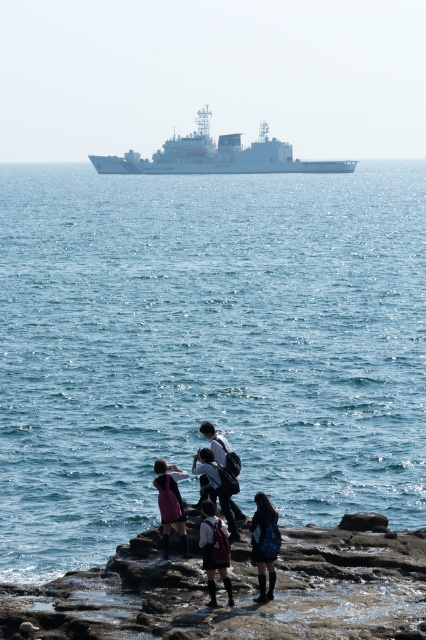
You are a photographer standing at the edge of the rocky shoreline. You want to capture a photo that includes both the point at coordinate point (x=192, y=611) and point at coordinate point (x=233, y=512). Which point will appear larger in your photo?

Point (x=192, y=611) is closer to the camera than point (x=233, y=512), so it will appear larger in the photo.

You are standing on the rugged stone coast at lower center represented by point (x=236, y=592). You want to move towards the ocean waves in the middle ground. Is the path clear of obstacles between your current position and the waves?

The rugged stone coast at lower center is represented by point (x=236, y=592). The path to the ocean waves in the middle ground is clear of obstacles as there are no objects mentioned between them in the scene description.

You are a photographer trying to capture the group of tourists on the rocky shoreline. You notice a point at coordinates point (213, 548). Based on the scene description, what object is located at that point?

The point (213, 548) is located on the dark blue denim skirt at center, which is part of a tourist or visitor dressed in casual attire.